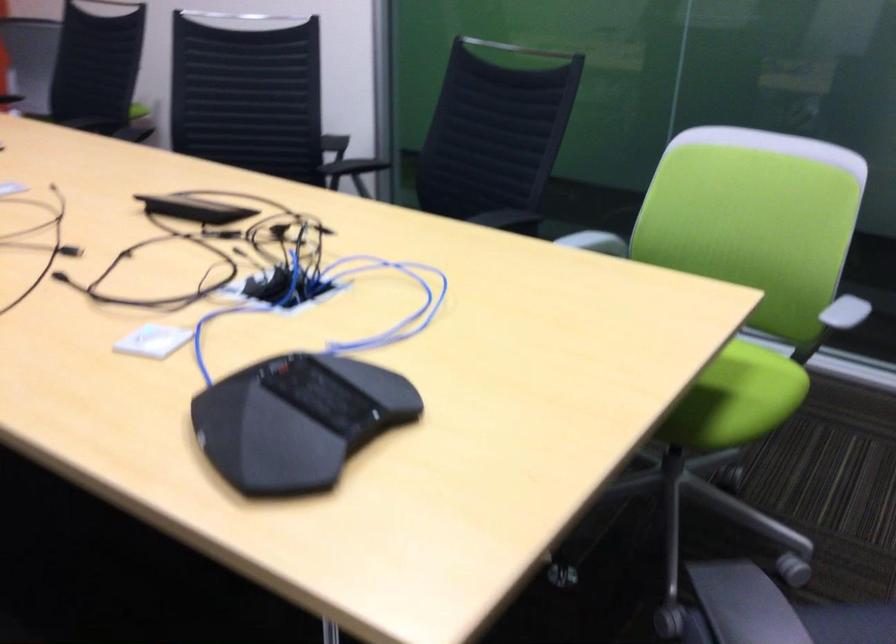
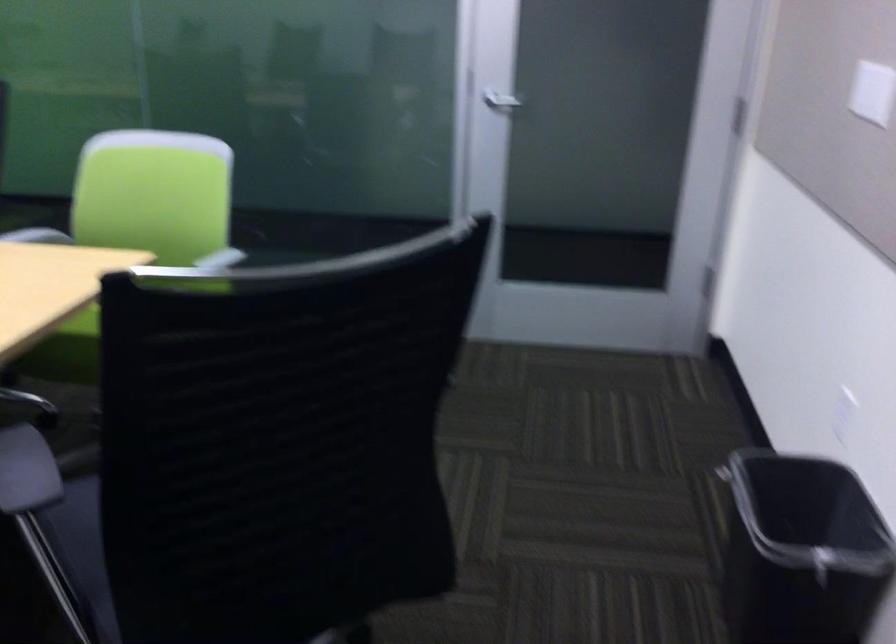
Question: The first image is from the beginning of the video and the second image is from the end. How did the camera likely rotate when shooting the video?

Choices:
 (A) Left
 (B) Right
 (C) Up
 (D) Down

Answer: (B)